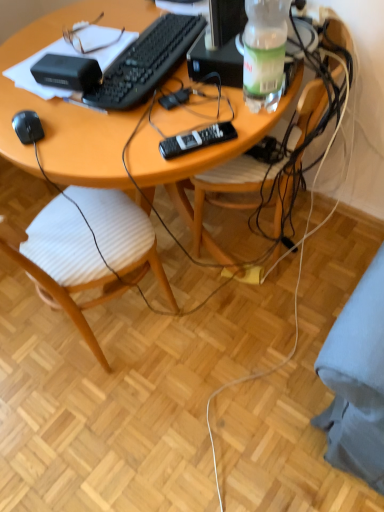
Locate an element on the screen. Image resolution: width=384 pixels, height=512 pixels. free space to the left of wooden chair at center, marked as the first chair in a left-to-right arrangement is located at coordinates (25, 338).